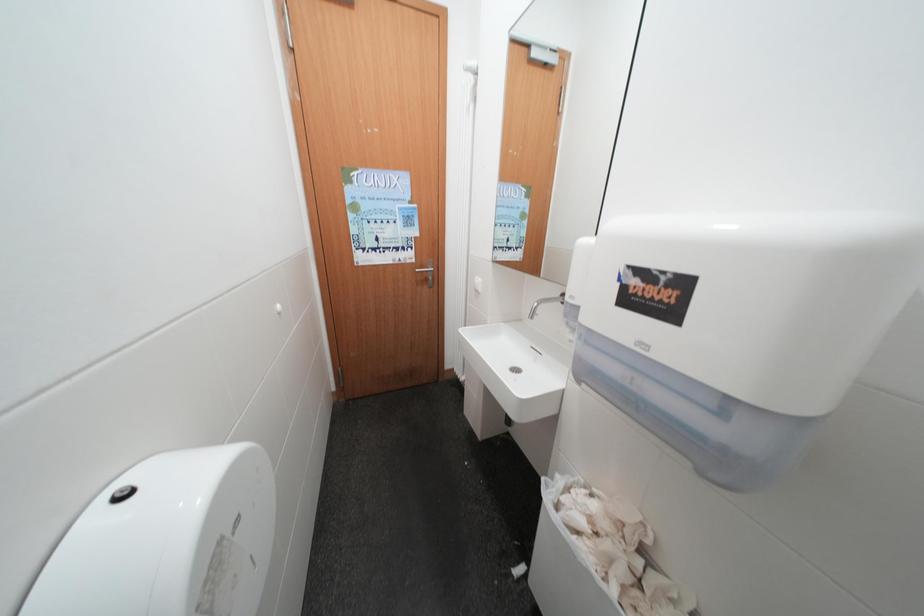
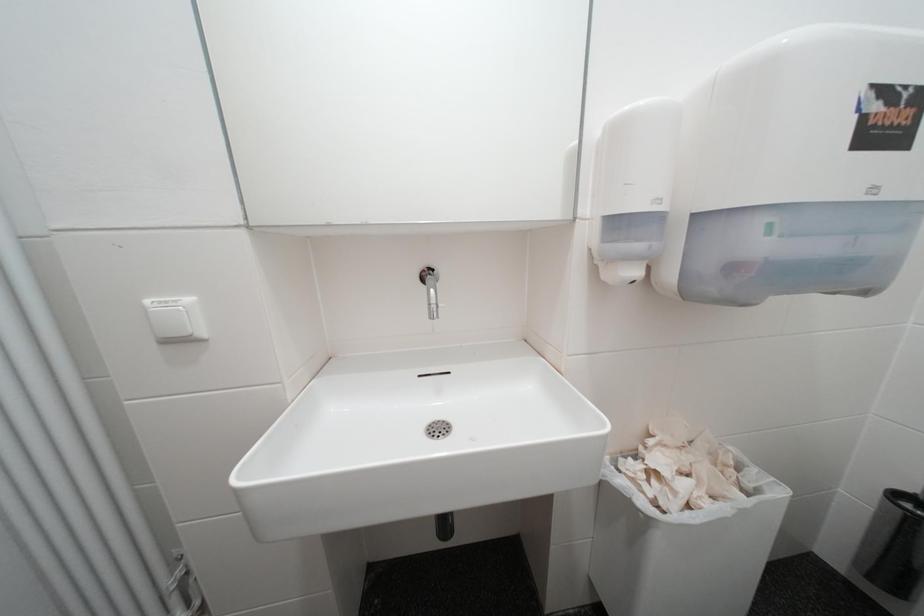
Question: The images are taken continuously from a first-person perspective. In which direction is your viewpoint rotating?

Choices:
 (A) Left
 (B) Right
 (C) Up
 (D) Down

Answer: (B)